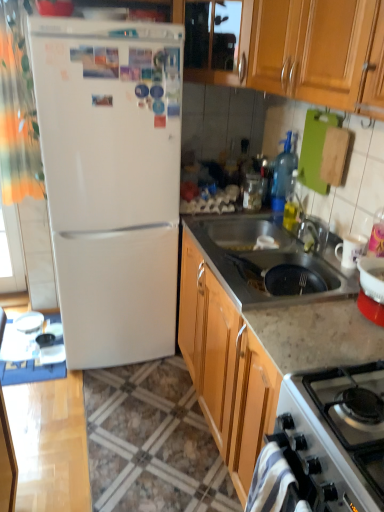
Question: Does point (145, 365) appear closer or farther from the camera than point (253, 232)?

Choices:
 (A) farther
 (B) closer

Answer: (A)

Question: In terms of width, does marble countertop at lower right look wider or thinner when compared to stainless steel sink at lower center?

Choices:
 (A) thin
 (B) wide

Answer: (B)

Question: Which of these objects is positioned closest to the white glossy gas stove at lower right?

Choices:
 (A) transparent glass jar at upper center
 (B) orange fabric curtain at left
 (C) white glossy refrigerator at left
 (D) marble countertop at lower right
 (E) stainless steel sink at lower center

Answer: (E)

Question: Estimate the real-world distances between objects in this image. Which object is closer to the stainless steel sink at lower center?

Choices:
 (A) orange fabric curtain at left
 (B) transparent glass jar at upper center
 (C) white glossy gas stove at lower right
 (D) marble countertop at lower right
 (E) white glossy refrigerator at left

Answer: (B)